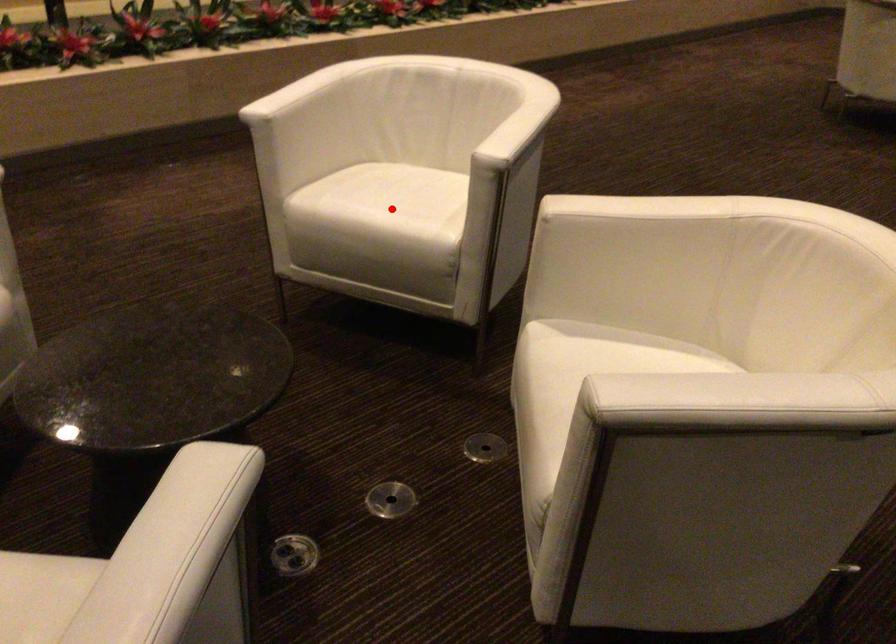
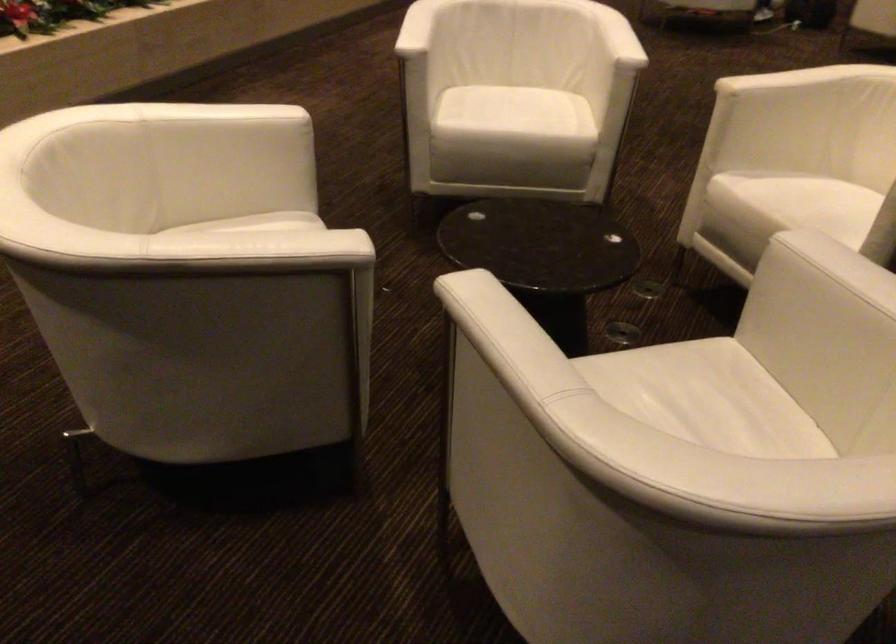
Question: I am providing you with two images of the same scene from different viewpoints. In image1, a red point is highlighted. Considering the same 3D point in image2, which of the following is correct?

Choices:
 (A) It is closer
 (B) It is farther

Answer: (B)